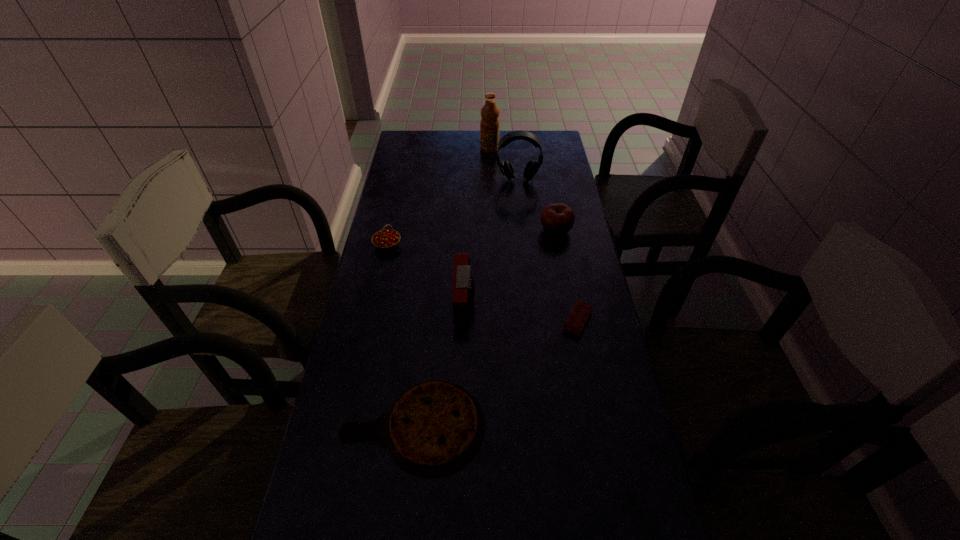
The width and height of the screenshot is (960, 540). I want to click on pizza that is at the left edge, so click(x=433, y=428).

Locate an element on the screen. This screenshot has width=960, height=540. earphone present at the right edge is located at coordinates (532, 167).

Locate an element on the screen. apple that is at the right edge is located at coordinates (557, 219).

Where is `Lego at the right edge`? Image resolution: width=960 pixels, height=540 pixels. Lego at the right edge is located at coordinates (581, 312).

Locate an element on the screen. vacant space at the far edge of the desktop is located at coordinates (522, 143).

The width and height of the screenshot is (960, 540). I want to click on free point at the left edge, so click(x=400, y=192).

Where is `vacant space at the right edge`? vacant space at the right edge is located at coordinates click(566, 195).

Find the location of a particular element. This screenshot has width=960, height=540. free space at the far left corner is located at coordinates (415, 141).

At what (x,y) coordinates should I click in order to perform the action: click on vacant point located between the Lego and the fruit juice. Please return your answer as a coordinate pair (x, y). This screenshot has height=540, width=960. Looking at the image, I should click on (534, 235).

Identify the location of free area in between the nearest object and the fifth tallest object. This screenshot has width=960, height=540. (400, 335).